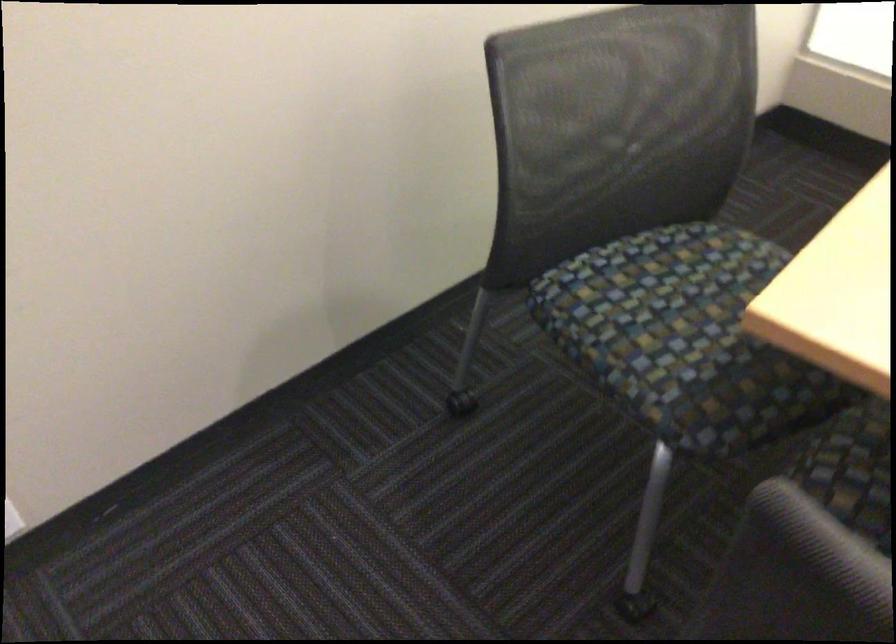
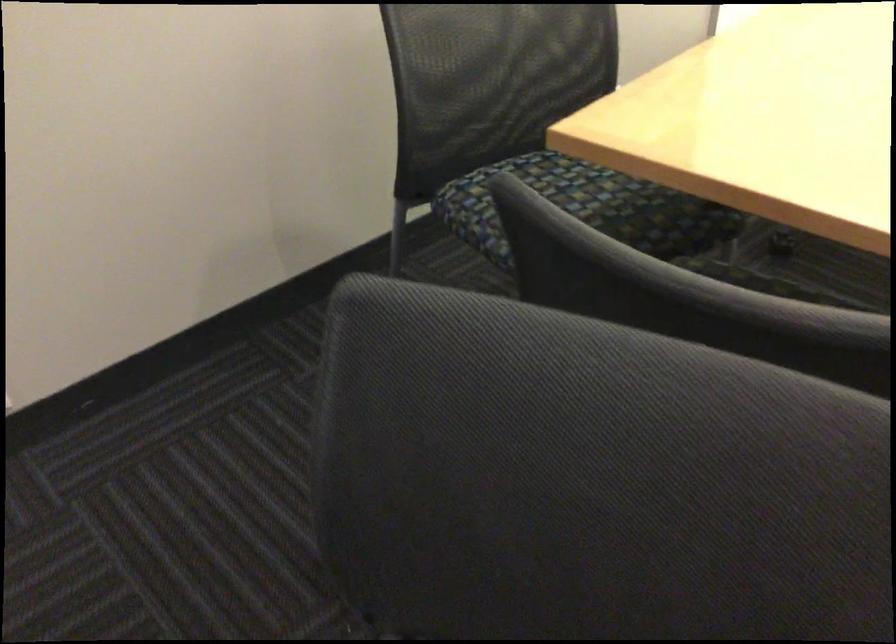
What movement of the cameraman would produce the second image?

The cameraman walked toward right, backward.